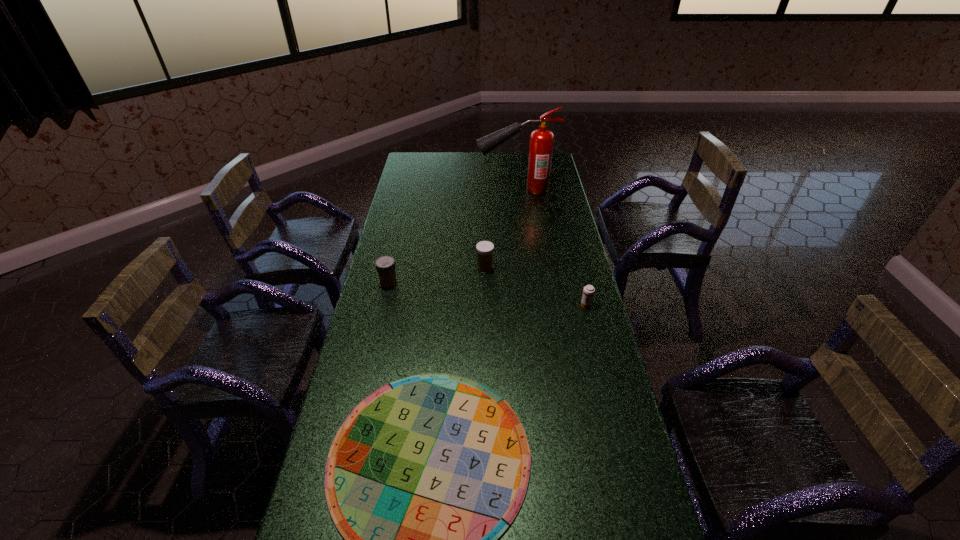
Where is `free spot at the far left corner of the desktop`? The width and height of the screenshot is (960, 540). free spot at the far left corner of the desktop is located at coordinates (417, 163).

The image size is (960, 540). Find the location of `empty location between the fourth nearest object and the third farthest object`. empty location between the fourth nearest object and the third farthest object is located at coordinates pyautogui.click(x=437, y=276).

Where is `free space between the third nearest object and the second medicine from right to left`? free space between the third nearest object and the second medicine from right to left is located at coordinates (437, 276).

Where is `free space between the fourth farthest object and the fire extinguisher`? free space between the fourth farthest object and the fire extinguisher is located at coordinates [551, 247].

You are a GUI agent. You are given a task and a screenshot of the screen. Output one action in this format:
    pyautogui.click(x=<x>, y=<y>)
    Task: Click on the free space between the rightmost medicine and the leftmost medicine
    
    Given the screenshot: What is the action you would take?
    pyautogui.click(x=488, y=294)

In order to click on vacant area that lies between the farthest medicine and the tallest object in this screenshot , I will do `click(501, 228)`.

What are the coordinates of `vacant point located between the second farthest object and the rightmost medicine` in the screenshot? It's located at (536, 286).

This screenshot has width=960, height=540. In order to click on empty location between the tallest object and the nearest medicine in this screenshot , I will do `click(551, 247)`.

Choose which object is the second nearest neighbor to the gameboard. Please provide its 2D coordinates. Your answer should be formatted as a tuple, i.e. [(x, y)], where the tuple contains the x and y coordinates of a point satisfying the conditions above.

[(385, 265)]

Where is `object that ranks as the fourth closest to the third farthest object`? The height and width of the screenshot is (540, 960). object that ranks as the fourth closest to the third farthest object is located at coordinates (541, 140).